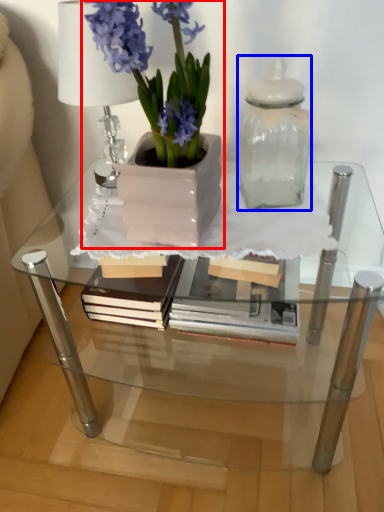
Question: Which object appears farthest to the camera in this image, houseplant (highlighted by a red box) or glass vase (highlighted by a blue box)?

Choices:
 (A) houseplant
 (B) glass vase

Answer: (B)